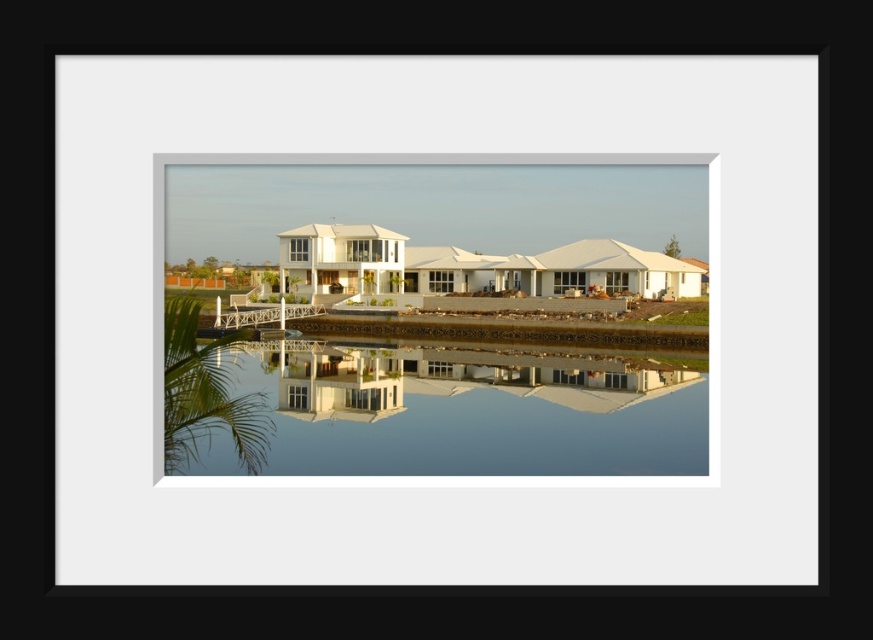
Question: Which of the following is the closest to the observer?

Choices:
 (A) white glossy house at center
 (B) clear glass water at center

Answer: (A)

Question: Among these points, which one is nearest to the camera?

Choices:
 (A) (265, 454)
 (B) (595, 432)
 (C) (258, 310)

Answer: (A)

Question: Is white glossy house at center bigger than white wooden dock at center?

Choices:
 (A) yes
 (B) no

Answer: (A)

Question: Does white glossy house at center lie in front of white wooden dock at center?

Choices:
 (A) yes
 (B) no

Answer: (A)

Question: Which point is farther to the camera?

Choices:
 (A) (322, 352)
 (B) (691, 332)

Answer: (A)

Question: Is clear glass water at center closer to the viewer compared to white wooden dock at center?

Choices:
 (A) yes
 (B) no

Answer: (A)